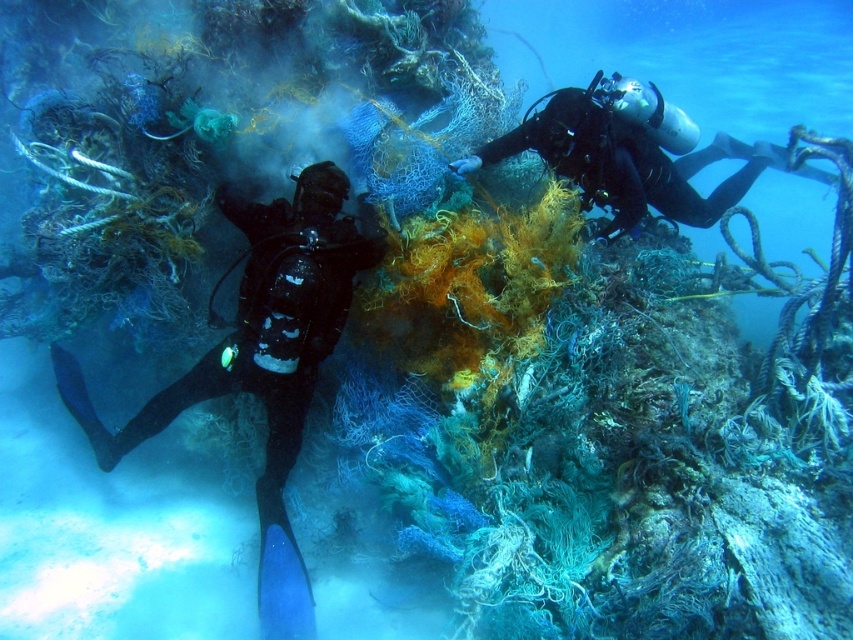
Question: From the image, what is the correct spatial relationship of black matte scuba diver at left in relation to black matte scuba diver at upper right?

Choices:
 (A) left
 (B) right

Answer: (A)

Question: Among these objects, which one is nearest to the camera?

Choices:
 (A) black matte scuba diver at left
 (B) black matte scuba diver at upper right

Answer: (A)

Question: Is black matte scuba diver at left behind black matte scuba diver at upper right?

Choices:
 (A) no
 (B) yes

Answer: (A)

Question: Observing the image, what is the correct spatial positioning of black matte scuba diver at left in reference to black matte scuba diver at upper right?

Choices:
 (A) left
 (B) right

Answer: (A)

Question: Which point is closer to the camera?

Choices:
 (A) pos(155,413)
 (B) pos(654,180)

Answer: (A)